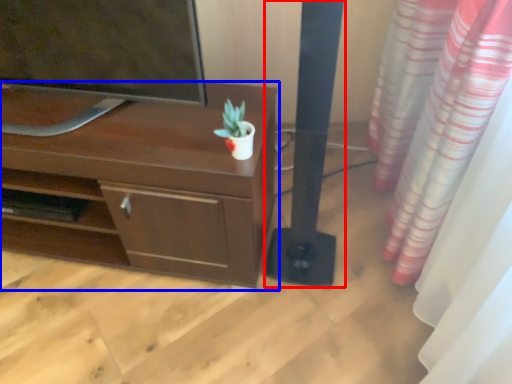
Question: Among these objects, which one is farthest to the camera, pillar (highlighted by a red box) or desk (highlighted by a blue box)?

Choices:
 (A) pillar
 (B) desk

Answer: (B)